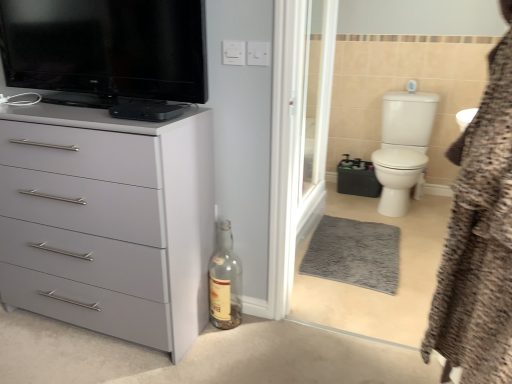
The image size is (512, 384). I want to click on free spot to the right of clear glass bottle at lower center, so point(259,327).